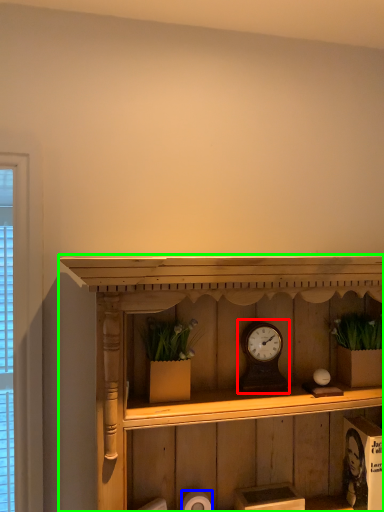
Question: Based on their relative distances, which object is nearer to alarm clock (highlighted by a red box)? Choose from toilet paper (highlighted by a blue box) and shelf (highlighted by a green box).

Choices:
 (A) toilet paper
 (B) shelf

Answer: (B)